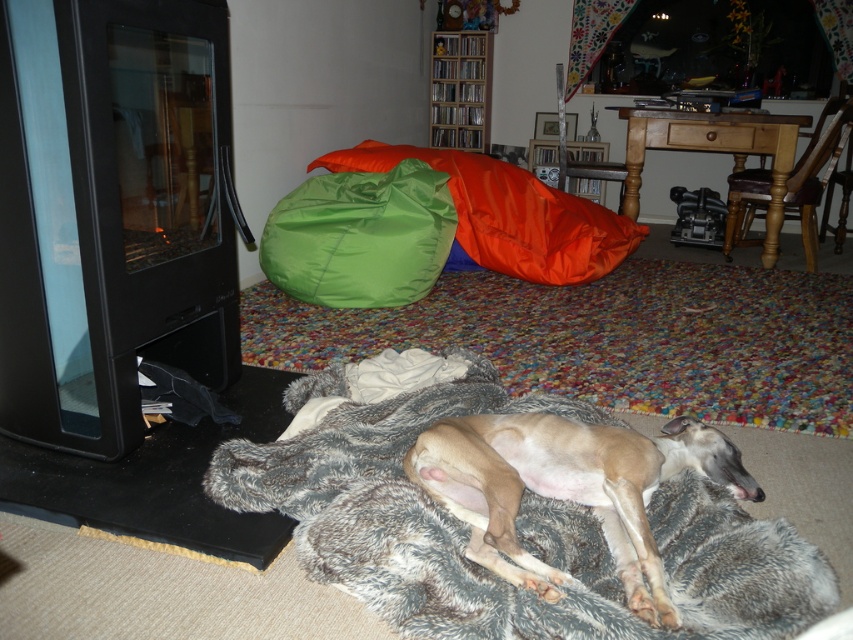
You are a dog owner who wants to place your dog on the fuzzy gray dog bed at lower center. Based on the scene description, can you determine the exact coordinates where you should place the dog?

The fuzzy gray dog bed at lower center is located at coordinates point [515,524], so you should place the dog there.

You are a dog owner who wants to place a new dog bed in the living room. The current fuzzy gray dog bed at lower center is at position coordinates 0.820, 0.606. If you want to place the new bed diagonally opposite to the existing one, where would you place it?

The fuzzy gray dog bed at lower center is located at point (x=515, y=524). To place the new bed diagonally opposite, you would position it at coordinates approximately (x=335, y=115).

You are standing in the living room and want to take a photo of both point (677, 548) and point (790, 172). Since you want both points to be in focus, which point should you focus on to ensure both are sharp?

You should focus on point (790, 172) because it is farther from the camera than point (677, 548). By focusing on the farther point, the closer point will also be within the depth of field, ensuring both are in focus.